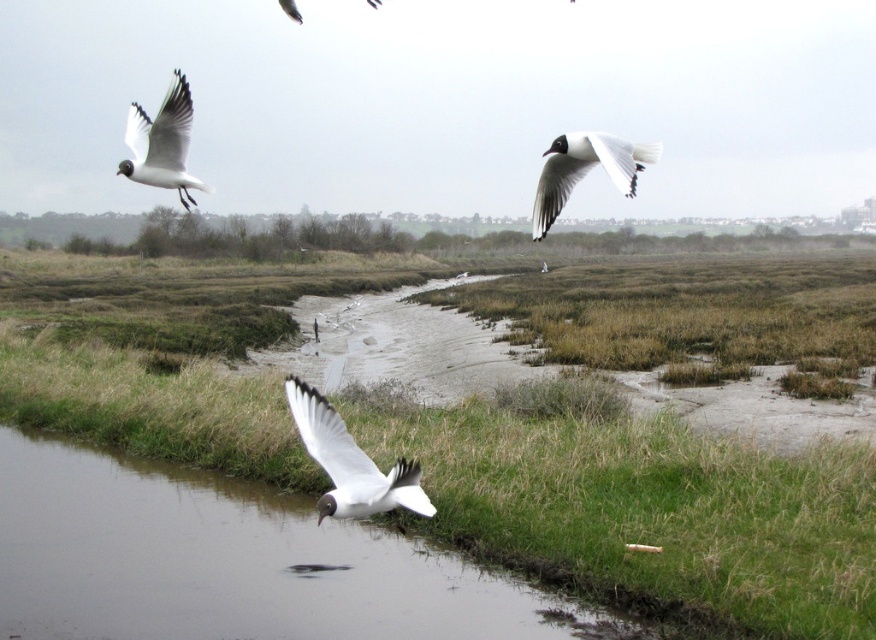
Does clear water at lower center appear on the left side of white matte bird at upper left?

In fact, clear water at lower center is to the right of white matte bird at upper left.

Between clear water at lower center and white matte bird at upper left, which one has less height?

clear water at lower center

Is point (41, 568) in front of point (136, 176)?

No, (41, 568) is behind (136, 176).

This screenshot has width=876, height=640. I want to click on clear water at lower center, so click(x=228, y=563).

Is clear water at lower center above white matte bird at upper right?

No.

Which is more to the right, clear water at lower center or white matte bird at upper right?

white matte bird at upper right

Does point (458, 584) come farther from viewer compared to point (545, 164)?

Yes, it is.

Where is `clear water at lower center`? This screenshot has height=640, width=876. clear water at lower center is located at coordinates (228, 563).

Who is positioned more to the left, white matte bird at center or white matte bird at upper left?

white matte bird at upper left

Describe the element at coordinates (350, 461) in the screenshot. This screenshot has height=640, width=876. I see `white matte bird at center` at that location.

Who is more distant from viewer, (316,406) or (135,115)?

The point (135,115) is more distant.

Where is `white matte bird at center`? The width and height of the screenshot is (876, 640). white matte bird at center is located at coordinates (350, 461).